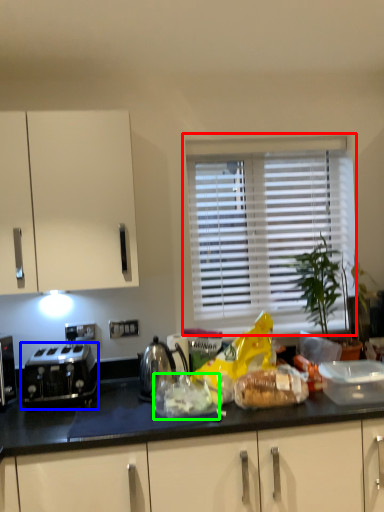
Question: Which is farther away from window (highlighted by a red box)? toaster (highlighted by a blue box) or food (highlighted by a green box)?

Choices:
 (A) toaster
 (B) food

Answer: (A)